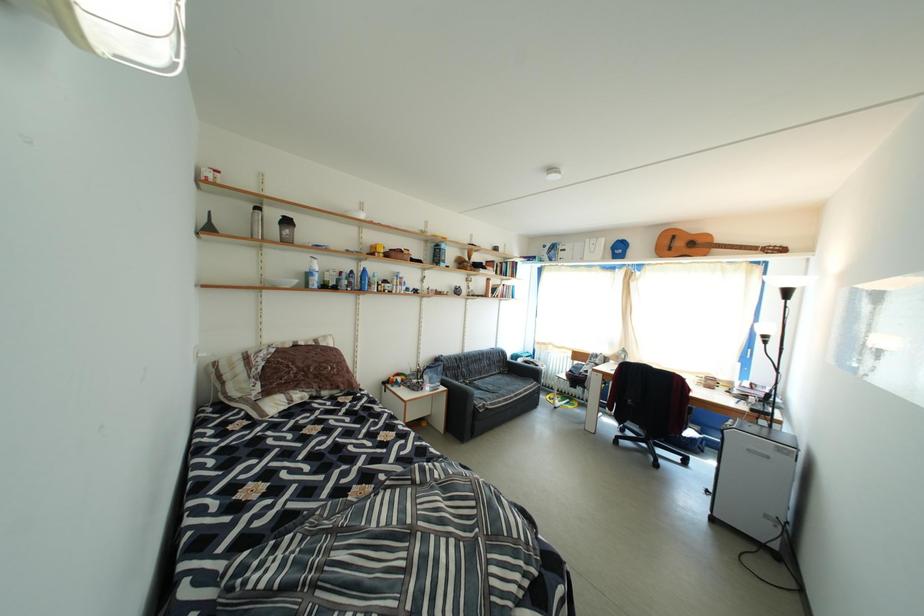
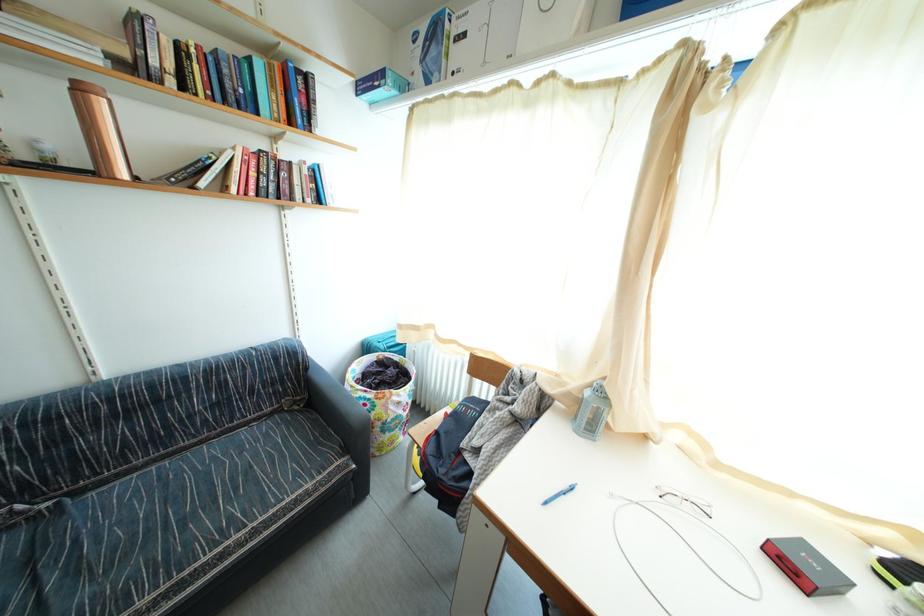
Which direction would the cameraman need to move to produce the second image?

The movement direction of the cameraman is right, forward.